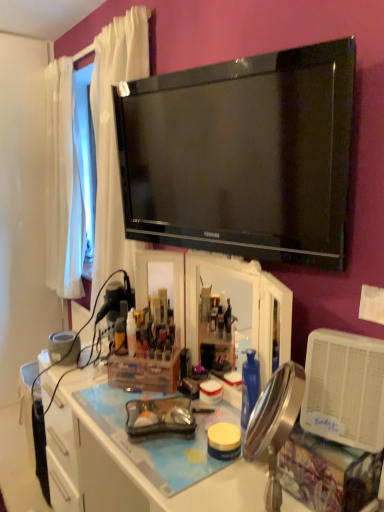
Question: From a real-world perspective, is clear plastic desk at center positioned above or below black glossy tv at upper center?

Choices:
 (A) below
 (B) above

Answer: (A)

Question: Considering the positions of clear plastic desk at center and black glossy tv at upper center in the image, is clear plastic desk at center taller or shorter than black glossy tv at upper center?

Choices:
 (A) tall
 (B) short

Answer: (A)

Question: Which object is the closest to the translucent plastic bottle at center, the first bottle when ordered from left to right?

Choices:
 (A) translucent plastic bottle at center, the 1th bottle when ordered from right to left
 (B) black glossy tv at upper center
 (C) translucent plastic container at center
 (D) clear plastic desk at center
 (E) metallic gold mirror at center

Answer: (A)

Question: Considering the real-world distances, which object is closest to the translucent plastic bottle at center, which is the 2th bottle in right-to-left order?

Choices:
 (A) clear plastic desk at center
 (B) translucent plastic bottle at center, the 1th bottle when ordered from right to left
 (C) translucent plastic container at center
 (D) black glossy tv at upper center
 (E) metallic gold mirror at center

Answer: (B)